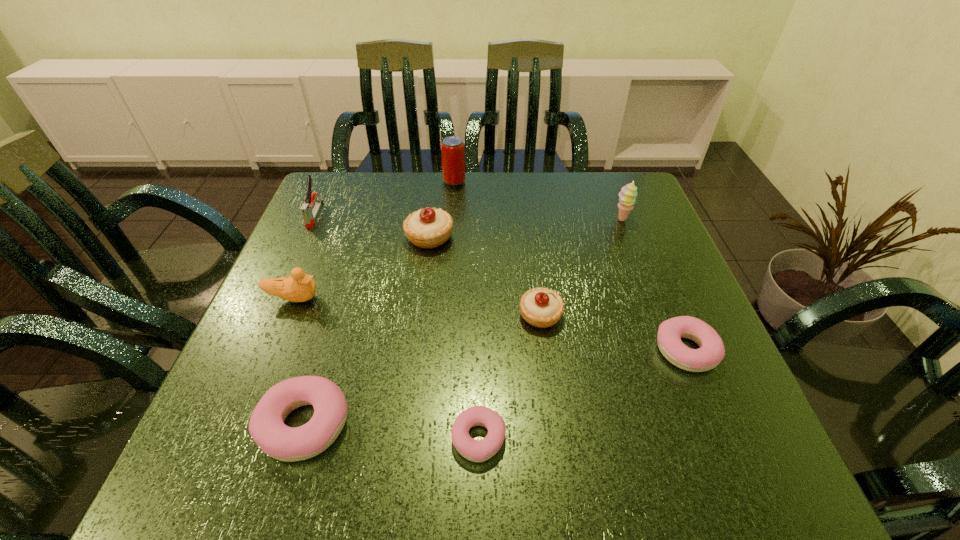
Identify the location of free spot at the far right corner of the desktop. (607, 206).

Where is `vacant space at the near right corner`? This screenshot has height=540, width=960. vacant space at the near right corner is located at coordinates (674, 475).

I want to click on vacant area that lies between the smallest pink pastry and the duckling, so click(386, 368).

Locate an element on the screen. This screenshot has width=960, height=540. free spot between the beer can and the seventh tallest object is located at coordinates (379, 303).

In order to click on free space between the stapler and the duckling in this screenshot , I will do `click(304, 256)`.

Find the location of a particular element. empty space that is in between the rightmost pastry and the seventh tallest object is located at coordinates (495, 387).

Find the location of a particular element. vacant space that's between the duckling and the sherbert is located at coordinates (458, 259).

Image resolution: width=960 pixels, height=540 pixels. Find the location of `empty location between the shortest pastry and the duckling`. empty location between the shortest pastry and the duckling is located at coordinates (386, 368).

What are the coordinates of `free spot between the right beige pastry and the duckling` in the screenshot? It's located at (417, 307).

Identify the location of free space between the smaller beige pastry and the third tallest pastry. This screenshot has height=540, width=960. (422, 370).